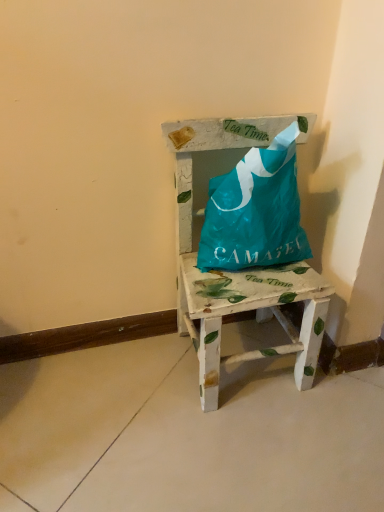
Question: Does painted wood chair at center appear on the left side of teal plastic bag at center?

Choices:
 (A) yes
 (B) no

Answer: (A)

Question: Can you confirm if painted wood chair at center is taller than teal plastic bag at center?

Choices:
 (A) yes
 (B) no

Answer: (A)

Question: Can you confirm if painted wood chair at center is smaller than teal plastic bag at center?

Choices:
 (A) yes
 (B) no

Answer: (B)

Question: From a real-world perspective, is painted wood chair at center located higher than teal plastic bag at center?

Choices:
 (A) no
 (B) yes

Answer: (A)

Question: Would you say painted wood chair at center is a long distance from teal plastic bag at center?

Choices:
 (A) yes
 (B) no

Answer: (B)

Question: Is painted wood chair at center positioned with its back to teal plastic bag at center?

Choices:
 (A) no
 (B) yes

Answer: (B)

Question: Does teal plastic bag at center have a lesser width compared to painted wood chair at center?

Choices:
 (A) no
 (B) yes

Answer: (B)

Question: From a real-world perspective, is teal plastic bag at center below painted wood chair at center?

Choices:
 (A) yes
 (B) no

Answer: (B)

Question: Could you tell me if teal plastic bag at center is turned towards painted wood chair at center?

Choices:
 (A) yes
 (B) no

Answer: (A)

Question: Is teal plastic bag at center far away from painted wood chair at center?

Choices:
 (A) no
 (B) yes

Answer: (A)

Question: Considering the relative positions of teal plastic bag at center and painted wood chair at center in the image provided, is teal plastic bag at center to the left of painted wood chair at center from the viewer's perspective?

Choices:
 (A) no
 (B) yes

Answer: (A)

Question: Considering the relative sizes of teal plastic bag at center and painted wood chair at center in the image provided, is teal plastic bag at center taller than painted wood chair at center?

Choices:
 (A) no
 (B) yes

Answer: (A)

Question: Based on their sizes in the image, would you say teal plastic bag at center is bigger or smaller than painted wood chair at center?

Choices:
 (A) small
 (B) big

Answer: (A)